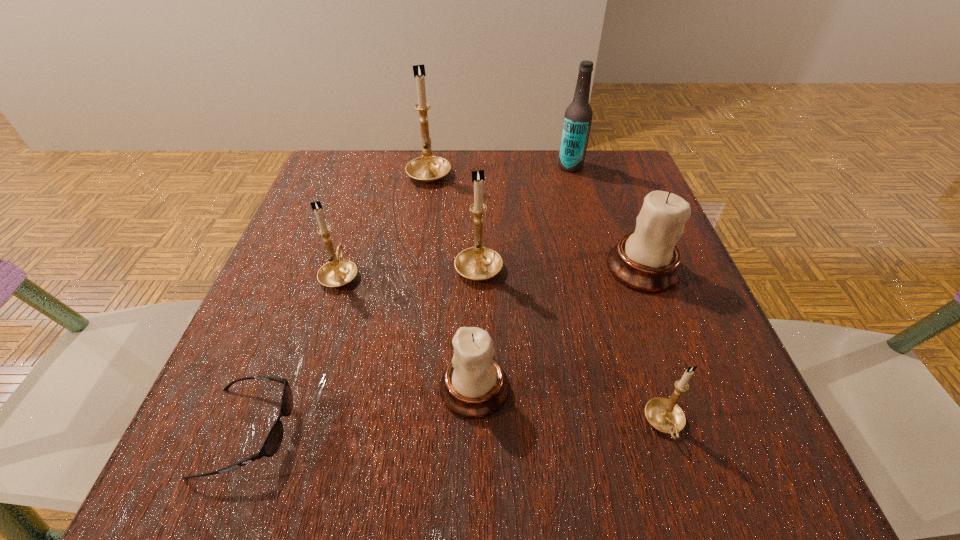
Locate an element on the screen. The image size is (960, 540). candle holder located in the near edge section of the desktop is located at coordinates (663, 414).

The image size is (960, 540). Identify the location of sunglasses at the near edge. (272, 443).

You are a GUI agent. You are given a task and a screenshot of the screen. Output one action in this format:
    pyautogui.click(x=<x>, y=<y>)
    Task: Click on the candle holder present at the left edge
    The width and height of the screenshot is (960, 540).
    Given the screenshot: What is the action you would take?
    pyautogui.click(x=338, y=272)

You are a GUI agent. You are given a task and a screenshot of the screen. Output one action in this format:
    pyautogui.click(x=<x>, y=<y>)
    Task: Click on the sunglasses located in the left edge section of the desktop
    
    Given the screenshot: What is the action you would take?
    pyautogui.click(x=272, y=443)

At what (x,y) coordinates should I click in order to perform the action: click on beer bottle that is at the right edge. Please return your answer as a coordinate pair (x, y). The height and width of the screenshot is (540, 960). Looking at the image, I should click on (578, 116).

This screenshot has width=960, height=540. I want to click on object that is positioned at the near left corner, so click(272, 443).

Find the location of a particular element. object that is at the far right corner is located at coordinates (578, 116).

Identify the location of object located in the near right corner section of the desktop. This screenshot has height=540, width=960. (663, 414).

In the image, there is a desktop. Identify the location of vacant space at the far edge. (399, 155).

In the image, there is a desktop. Where is `vacant space at the near edge`? The height and width of the screenshot is (540, 960). vacant space at the near edge is located at coordinates (456, 494).